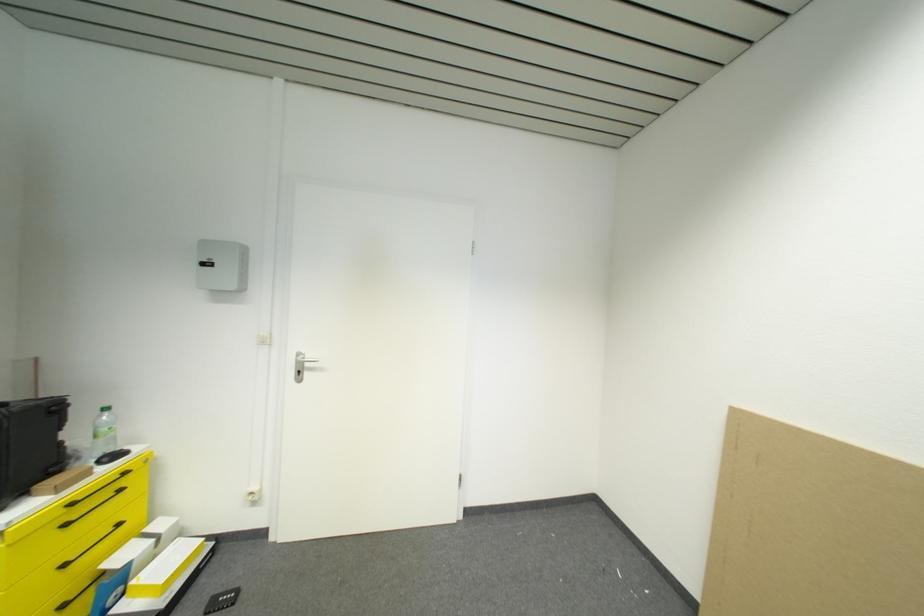
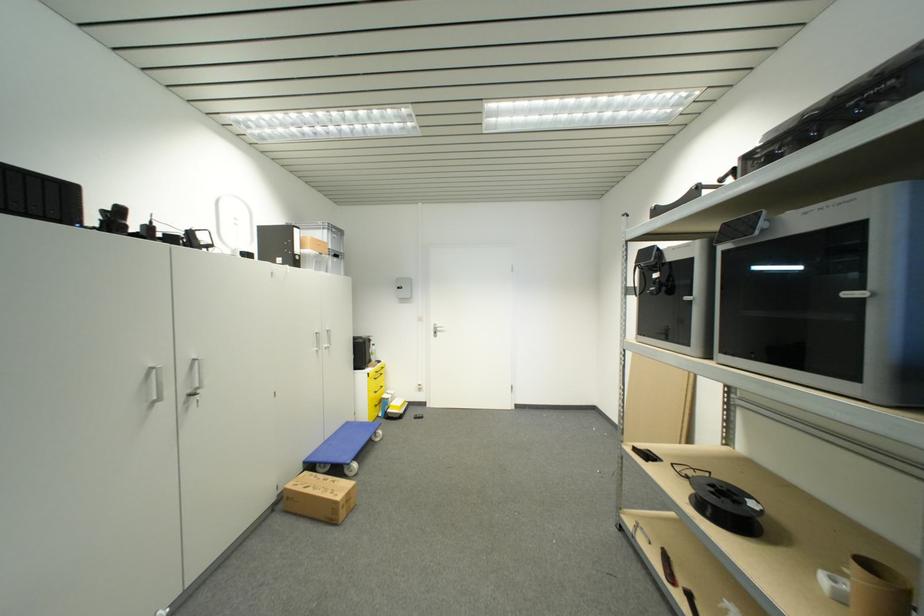
Question: In a continuous first-person perspective shot, in which direction is the camera moving?

Choices:
 (A) Left
 (B) Right
 (C) Forward
 (D) Backward

Answer: (D)